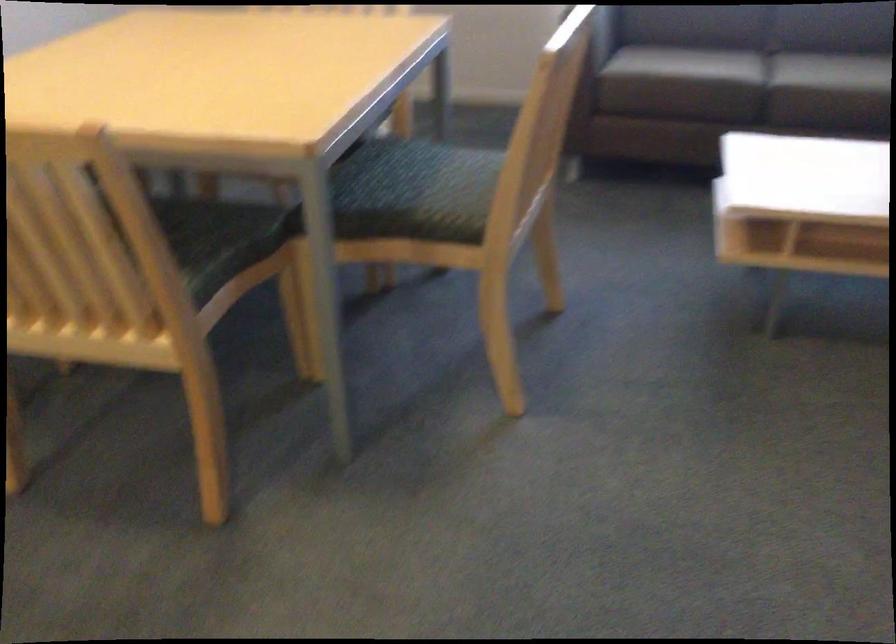
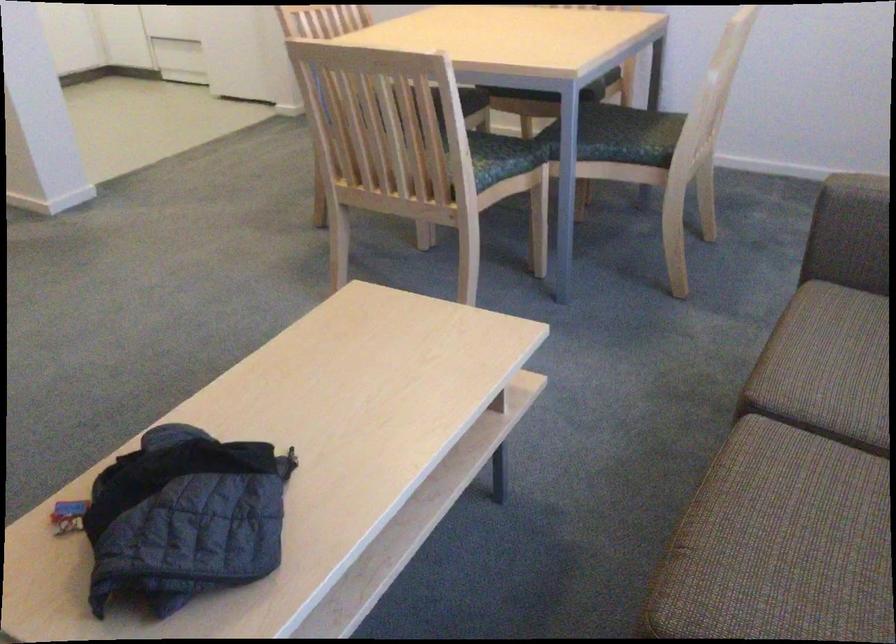
Where in the second image is the point corresponding to point (429, 153) from the first image?

(501, 158)